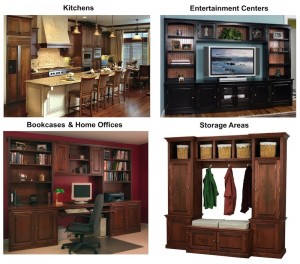
Locate an element on the screen. light fixtures is located at coordinates (76, 31), (96, 34), (112, 37).